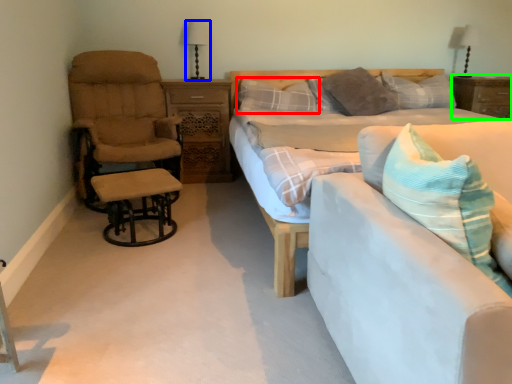
Question: Estimate the real-world distances between objects in this image. Which object is farther from pillow (highlighted by a red box), table lamp (highlighted by a blue box) or nightstand (highlighted by a green box)?

Choices:
 (A) table lamp
 (B) nightstand

Answer: (B)